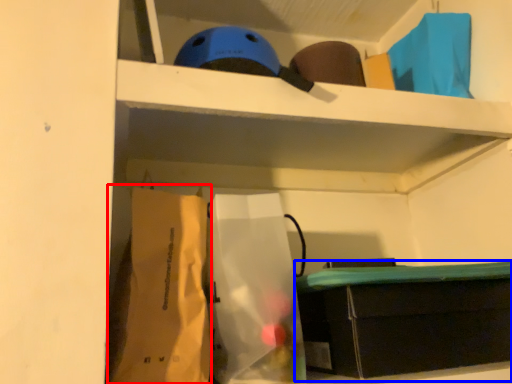
Question: Which object is closer to the camera taking this photo, paper bag (highlighted by a red box) or furniture (highlighted by a blue box)?

Choices:
 (A) paper bag
 (B) furniture

Answer: (A)